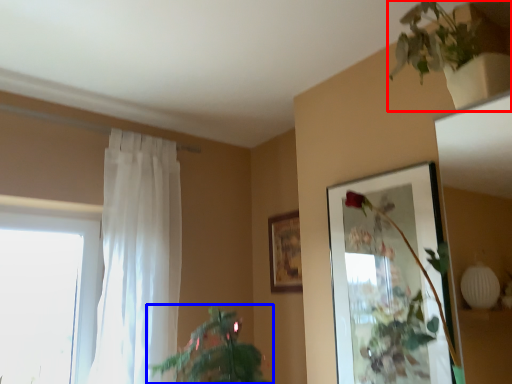
Question: Which of the following is the closest to the observer, houseplant (highlighted by a red box) or houseplant (highlighted by a blue box)?

Choices:
 (A) houseplant
 (B) houseplant

Answer: (A)